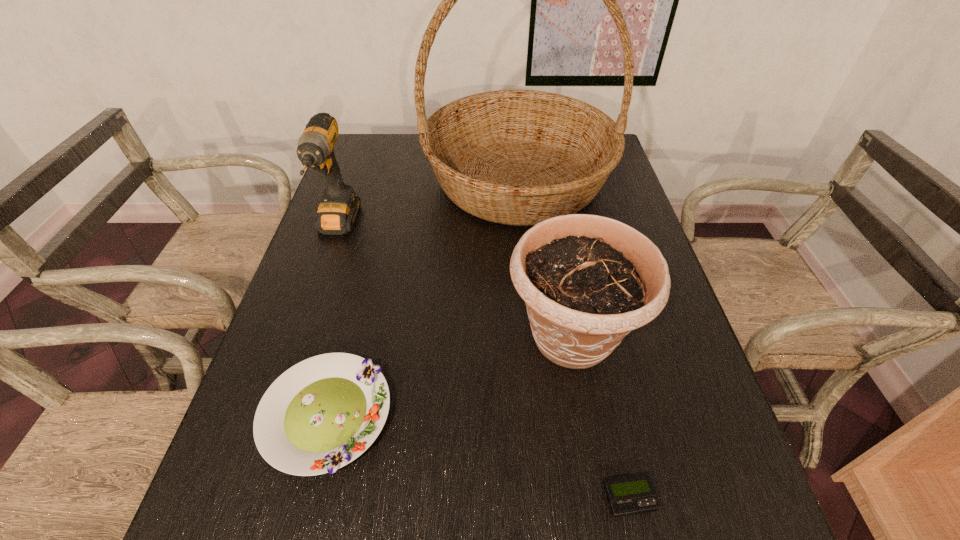
Where is `free spot between the salad plate and the beeper`? Image resolution: width=960 pixels, height=540 pixels. free spot between the salad plate and the beeper is located at coordinates (478, 456).

Where is `vacant point located between the drill and the flowerpot`? Image resolution: width=960 pixels, height=540 pixels. vacant point located between the drill and the flowerpot is located at coordinates click(x=455, y=282).

Find the location of a particular element. Image resolution: width=960 pixels, height=540 pixels. vacant area between the beeper and the salad plate is located at coordinates coord(478,456).

This screenshot has width=960, height=540. In order to click on vacant area that lies between the flowerpot and the salad plate in this screenshot , I will do `click(449, 376)`.

Identify the location of free spot between the drill and the flowerpot. (455, 282).

Where is `vacant space in between the shortest object and the flowerpot`? vacant space in between the shortest object and the flowerpot is located at coordinates (600, 417).

Where is `blank region between the beeper and the third shortest object`? This screenshot has height=540, width=960. blank region between the beeper and the third shortest object is located at coordinates (600, 417).

Locate an element on the screen. This screenshot has width=960, height=540. free area in between the second shortest object and the flowerpot is located at coordinates (449, 376).

This screenshot has width=960, height=540. Identify the location of the fourth closest object to the basket. (631, 495).

Locate an element on the screen. This screenshot has height=540, width=960. the second closest object to the drill is located at coordinates (321, 414).